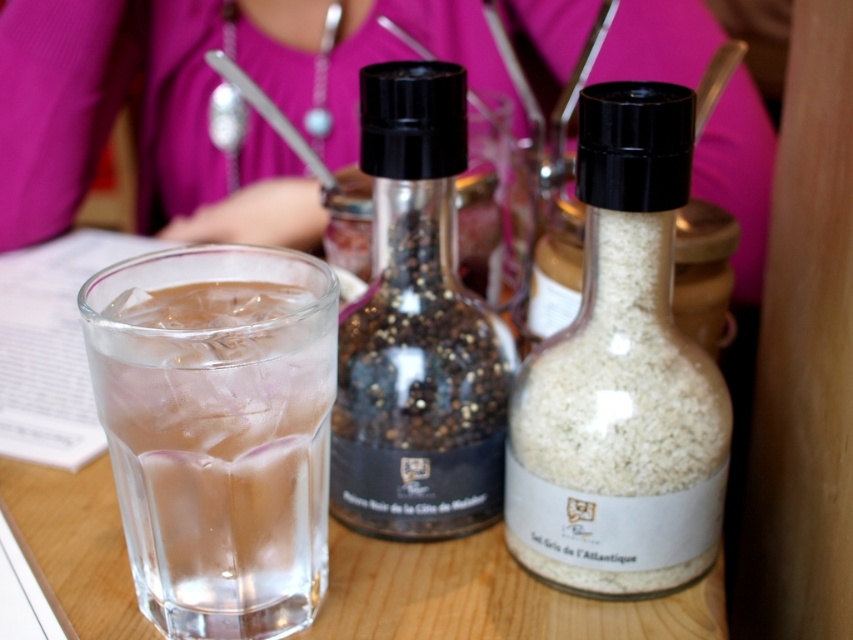
Question: Does white matte salt shaker at center appear over black glass bottle at center?

Choices:
 (A) no
 (B) yes

Answer: (A)

Question: Which object appears closest to the camera in this image?

Choices:
 (A) black glass bottle at center
 (B) clear glass at center
 (C) white matte salt shaker at center

Answer: (B)

Question: Does white matte salt shaker at center have a larger size compared to black glass bottle at center?

Choices:
 (A) yes
 (B) no

Answer: (A)

Question: Is clear glass at center further to the viewer compared to black glass bottle at center?

Choices:
 (A) yes
 (B) no

Answer: (B)

Question: Which of the following is the closest to the observer?

Choices:
 (A) (532, 496)
 (B) (433, 128)

Answer: (B)

Question: Which object is positioned farthest from the white matte salt shaker at center?

Choices:
 (A) black glass bottle at center
 (B) clear glass at center

Answer: (B)